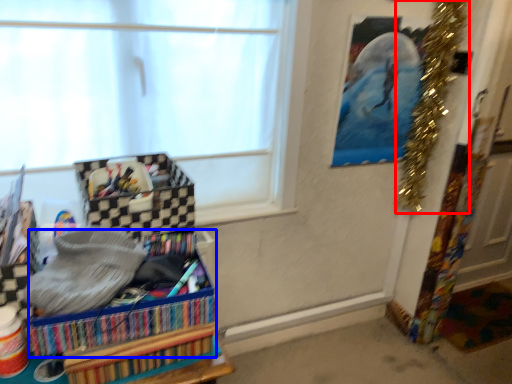
Question: Which object is further to the camera taking this photo, christmas decoration (highlighted by a red box) or storage box (highlighted by a blue box)?

Choices:
 (A) christmas decoration
 (B) storage box

Answer: (A)